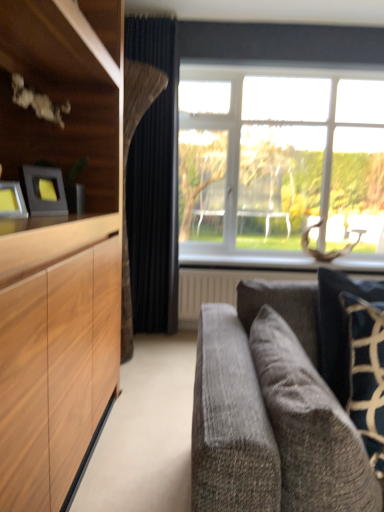
Question: Considering the relative positions of velvet gray couch at lower right and white textured radiator at lower center in the image provided, is velvet gray couch at lower right to the right of white textured radiator at lower center from the viewer's perspective?

Choices:
 (A) yes
 (B) no

Answer: (B)

Question: Is velvet gray couch at lower right wider than white textured radiator at lower center?

Choices:
 (A) yes
 (B) no

Answer: (A)

Question: Considering the relative sizes of velvet gray couch at lower right and white textured radiator at lower center in the image provided, is velvet gray couch at lower right bigger than white textured radiator at lower center?

Choices:
 (A) no
 (B) yes

Answer: (A)

Question: Can white textured radiator at lower center be found inside velvet gray couch at lower right?

Choices:
 (A) yes
 (B) no

Answer: (B)

Question: Is velvet gray couch at lower right oriented towards white textured radiator at lower center?

Choices:
 (A) no
 (B) yes

Answer: (A)

Question: Is point (213, 179) closer or farther from the camera than point (157, 329)?

Choices:
 (A) closer
 (B) farther

Answer: (B)

Question: Looking at the image, does clear glass window at center seem bigger or smaller compared to dark blue velvet curtain at center?

Choices:
 (A) big
 (B) small

Answer: (A)

Question: Would you say clear glass window at center is inside or outside dark blue velvet curtain at center?

Choices:
 (A) inside
 (B) outside

Answer: (B)

Question: In terms of height, does clear glass window at center look taller or shorter compared to dark blue velvet curtain at center?

Choices:
 (A) tall
 (B) short

Answer: (B)

Question: From a real-world perspective, is white textured radiator at lower center above or below clear glass window at center?

Choices:
 (A) below
 (B) above

Answer: (A)

Question: Visually, is white textured radiator at lower center positioned to the left or to the right of clear glass window at center?

Choices:
 (A) right
 (B) left

Answer: (B)

Question: Is white textured radiator at lower center bigger or smaller than clear glass window at center?

Choices:
 (A) small
 (B) big

Answer: (A)

Question: Is white textured radiator at lower center in front of or behind clear glass window at center in the image?

Choices:
 (A) front
 (B) behind

Answer: (B)

Question: Does point (4, 205) appear closer or farther from the camera than point (259, 222)?

Choices:
 (A) farther
 (B) closer

Answer: (B)

Question: From a real-world perspective, relative to clear glass window at center, is metallic silver picture frame at left, which is the 2th picture frame in back-to-front order, vertically above or below?

Choices:
 (A) above
 (B) below

Answer: (B)